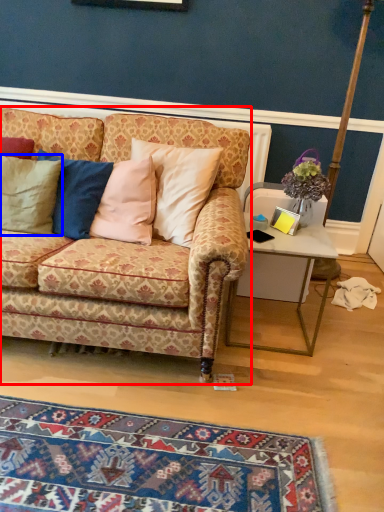
Question: Which object appears farthest to the camera in this image, studio couch (highlighted by a red box) or pillow (highlighted by a blue box)?

Choices:
 (A) studio couch
 (B) pillow

Answer: (B)